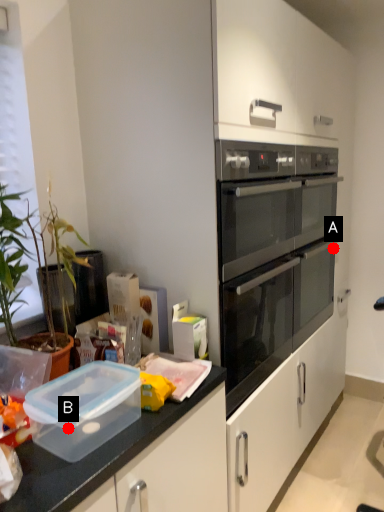
Question: Two points are circled on the image, labeled by A and B beside each circle. Which point is closer to the camera?

Choices:
 (A) A is closer
 (B) B is closer

Answer: (B)